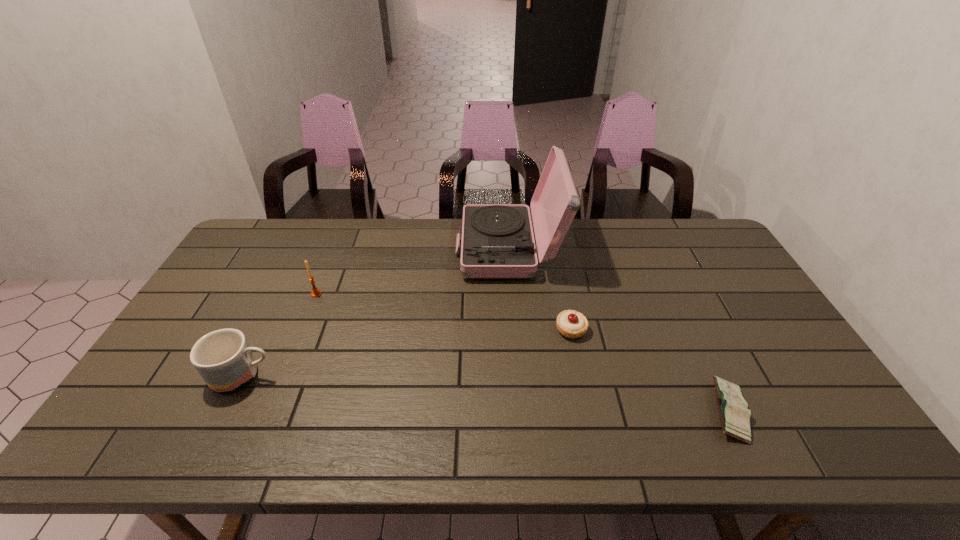
In the image, there is a desktop. At what (x,y) coordinates should I click in order to perform the action: click on vacant space at the far edge. Please return your answer as a coordinate pair (x, y). Looking at the image, I should click on (285, 249).

The image size is (960, 540). I want to click on vacant space at the near edge of the desktop, so click(593, 446).

In order to click on free space at the left edge of the desktop in this screenshot , I will do `click(252, 292)`.

The width and height of the screenshot is (960, 540). In order to click on free spot at the right edge of the desktop in this screenshot , I will do `click(749, 292)`.

In the image, there is a desktop. Where is `free space at the far left corner`? The width and height of the screenshot is (960, 540). free space at the far left corner is located at coordinates coord(289,226).

In the image, there is a desktop. What are the coordinates of `vacant area at the far right corner` in the screenshot? It's located at (688, 230).

Identify the location of free space at the near right corner of the desktop. Image resolution: width=960 pixels, height=540 pixels. (828, 443).

Find the location of `free space that is in between the pastry and the record player`. free space that is in between the pastry and the record player is located at coordinates (540, 289).

Locate an element on the screen. The image size is (960, 540). unoccupied position between the rightmost object and the tallest object is located at coordinates (618, 330).

In order to click on free point between the diary and the second farthest object in this screenshot , I will do `click(522, 353)`.